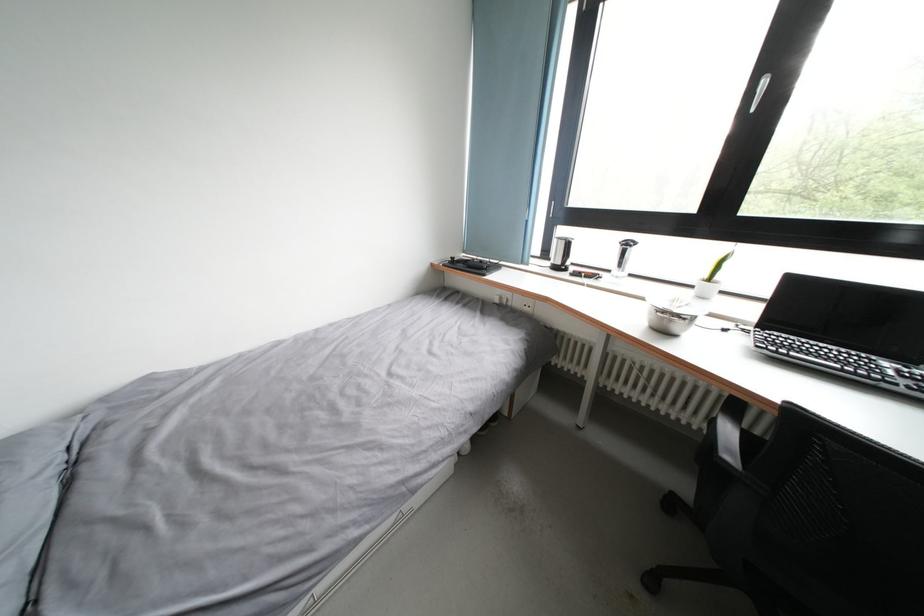
Where would you turn the white window handle? Please return your answer as a coordinate pair (x, y).

(759, 91)